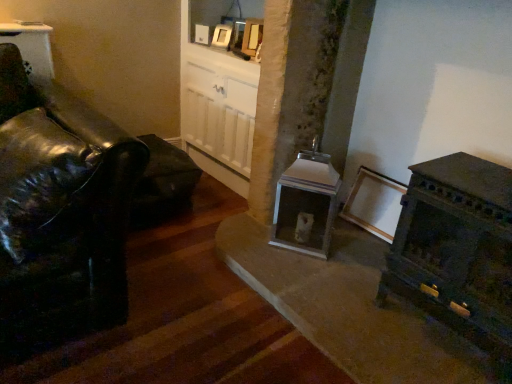
This screenshot has height=384, width=512. Find the location of `vacant space to the left of metallic silver fireplace at center`. vacant space to the left of metallic silver fireplace at center is located at coordinates (245, 240).